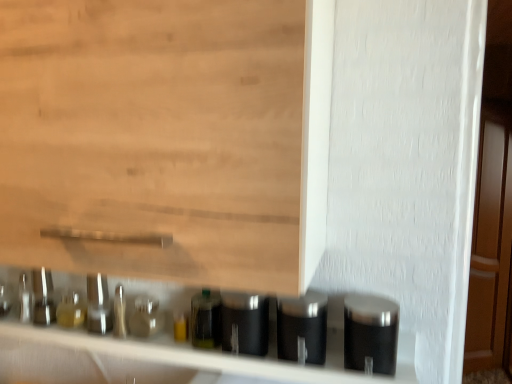
Identify the location of vacant space to the left of satin metallic canister at center, which is counted as the 1th silver, starting from the left. This screenshot has width=512, height=384. (170, 349).